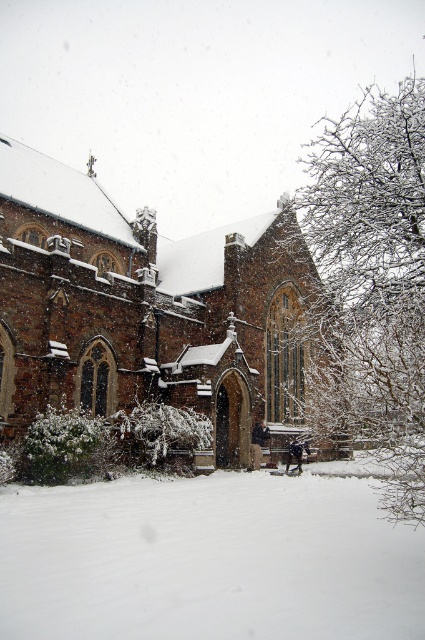
Question: Is brown stone church at center in front of white fluffy snow at lower center?

Choices:
 (A) yes
 (B) no

Answer: (B)

Question: Can you confirm if brown stone church at center is positioned to the right of white fluffy snow at lower center?

Choices:
 (A) yes
 (B) no

Answer: (B)

Question: Can you confirm if brown stone church at center is bigger than white fluffy snow at lower center?

Choices:
 (A) yes
 (B) no

Answer: (A)

Question: Which point is farther from the camera taking this photo?

Choices:
 (A) (297, 400)
 (B) (110, 566)

Answer: (A)